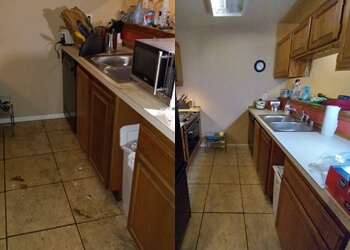
Where is `crock pot`? crock pot is located at coordinates (66, 41).